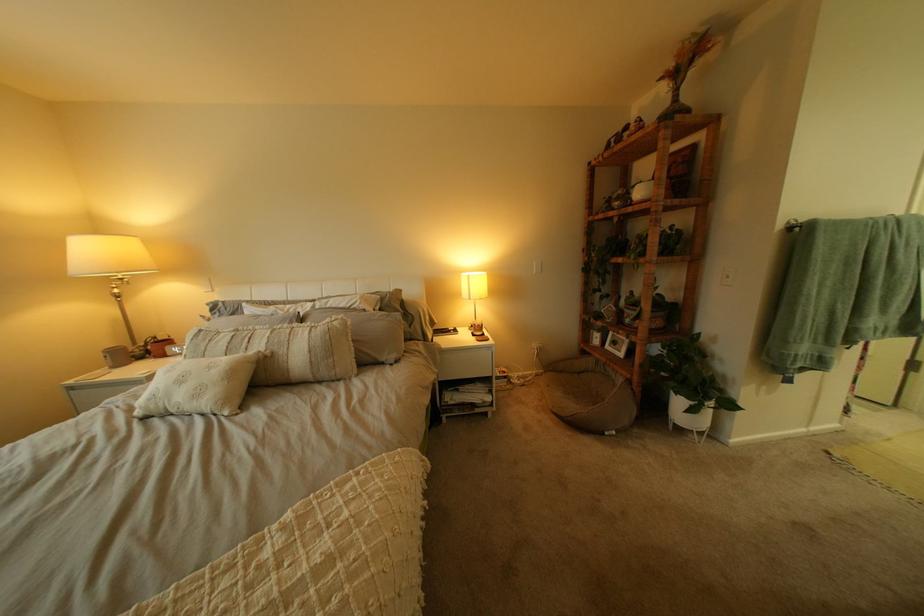
You are a GUI agent. You are given a task and a screenshot of the screen. Output one action in this format:
    pyautogui.click(x=<x>, y=<y>)
    Task: Click on the white plant pot
    Image resolution: width=924 pixels, height=616 pixels.
    Given the screenshot: What is the action you would take?
    pyautogui.click(x=688, y=384)